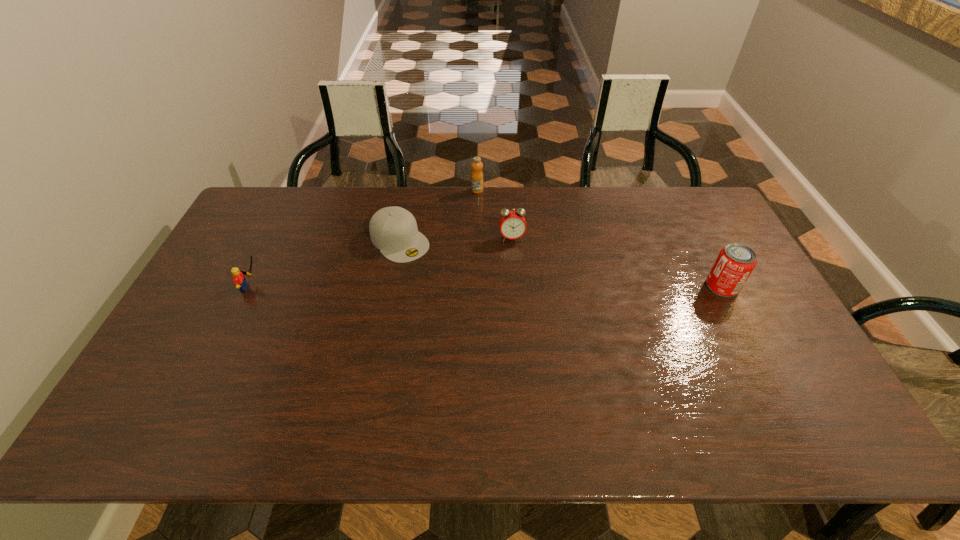
At what (x,y) coordinates should I click in order to perform the action: click on free space between the orange juice and the can. Please return your answer as a coordinate pair (x, y). Image resolution: width=960 pixels, height=540 pixels. Looking at the image, I should click on click(600, 239).

The image size is (960, 540). In order to click on free space between the alarm clock and the third object from right to left in this screenshot , I will do (494, 214).

The height and width of the screenshot is (540, 960). I want to click on free point between the alarm clock and the third object from right to left, so click(x=494, y=214).

The image size is (960, 540). Find the location of `empty space between the third object from right to left and the can`. empty space between the third object from right to left and the can is located at coordinates (600, 239).

What are the coordinates of `vacant area that lies between the second object from left to right and the Lego` in the screenshot? It's located at (325, 264).

Image resolution: width=960 pixels, height=540 pixels. Identify the location of vacant space that is in between the rightmost object and the third object from left to right. (600, 239).

Locate which object ranks in proximity to the shortest object. Please provide its 2D coordinates. Your answer should be formatted as a tuple, i.e. [(x, y)], where the tuple contains the x and y coordinates of a point satisfying the conditions above.

[(477, 175)]

Locate which object ranks in proximity to the fourth object from right to left. Please provide its 2D coordinates. Your answer should be formatted as a tuple, i.e. [(x, y)], where the tuple contains the x and y coordinates of a point satisfying the conditions above.

[(477, 175)]

This screenshot has width=960, height=540. I want to click on free spot that satisfies the following two spatial constraints: 1. on the front side of the second object from left to right; 2. on the left side of the rightmost object, so click(x=391, y=286).

I want to click on free spot that satisfies the following two spatial constraints: 1. on the back side of the shortest object; 2. on the left side of the third object from right to left, so click(x=409, y=191).